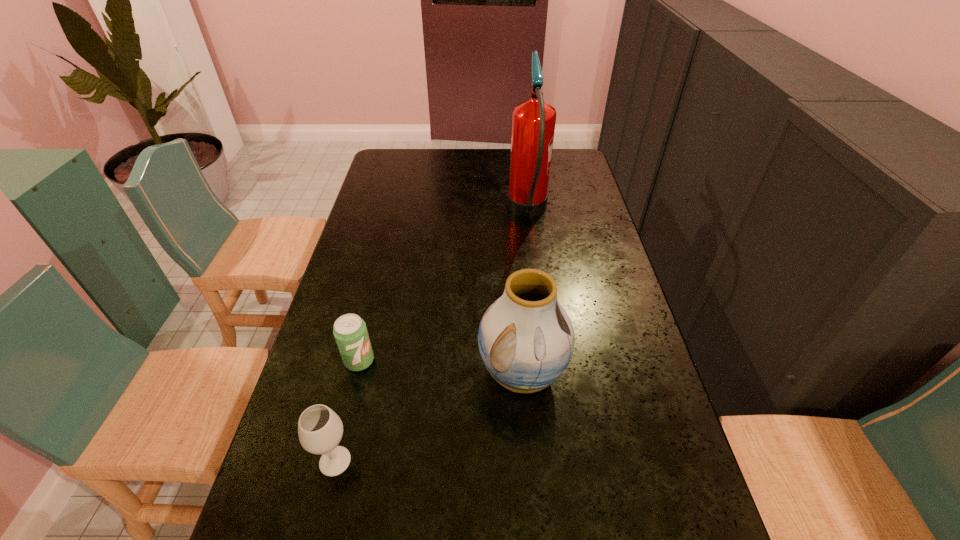
Locate an element on the screen. The width and height of the screenshot is (960, 540). vacant point located between the shortest object and the fire extinguisher is located at coordinates (444, 286).

Identify the location of vacant area between the shortest object and the second tallest object. The width and height of the screenshot is (960, 540). (441, 367).

This screenshot has height=540, width=960. Find the location of `free space between the vase and the nearest object`. free space between the vase and the nearest object is located at coordinates [428, 417].

The height and width of the screenshot is (540, 960). I want to click on vacant region between the farthest object and the shortest object, so click(444, 286).

Locate an element on the screen. vacant area that lies between the second shortest object and the farthest object is located at coordinates (431, 336).

I want to click on empty space between the shortest object and the second tallest object, so click(441, 367).

Find the location of `free spot between the nearest object and the second tallest object`. free spot between the nearest object and the second tallest object is located at coordinates (428, 417).

This screenshot has width=960, height=540. Find the location of `the second closest object to the vase`. the second closest object to the vase is located at coordinates (320, 429).

Point out which object is positioned as the nearest to the nearest object. Please provide its 2D coordinates. Your answer should be formatted as a tuple, i.e. [(x, y)], where the tuple contains the x and y coordinates of a point satisfying the conditions above.

[(350, 332)]